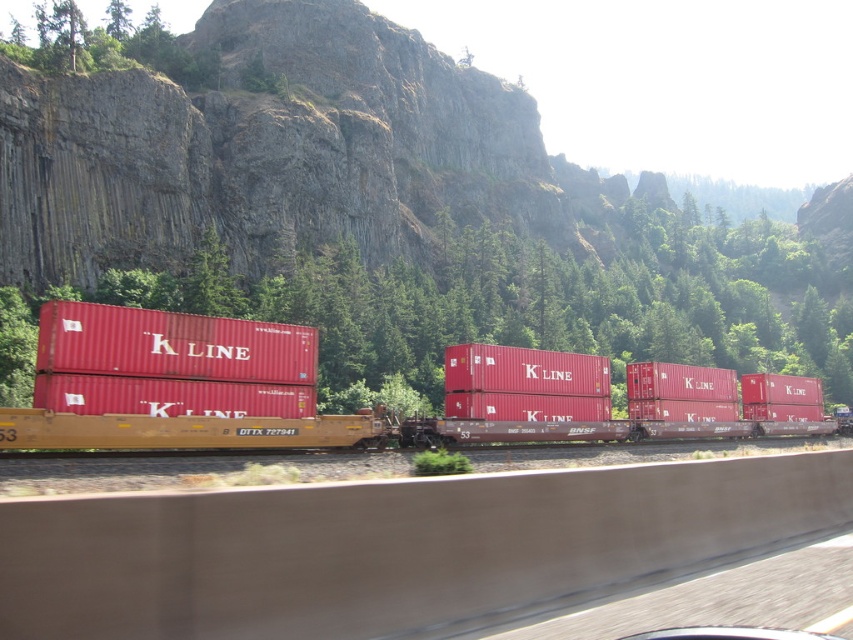
From the picture: You are a photographer standing near the concrete barrier in the foreground of the scene. You want to capture a photo of the matte red shipping container at center and the matte red container at center. However, you notice that one of the containers is partially blocking the other. Which container is closer to you, and why?

The matte red shipping container at center is closer to you because it is partially blocking the matte red container at center, indicating that it is in front of the other container.